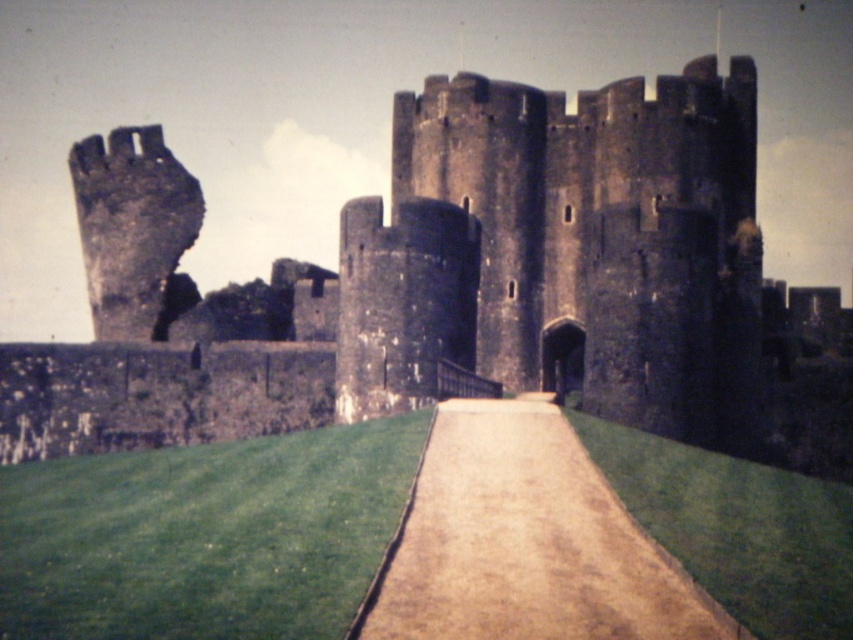
Between point (328, 328) and point (595, 580), which one is positioned in front?

Point (595, 580)

Which is in front, point (10, 432) or point (590, 458)?

Point (590, 458) is more forward.

Image resolution: width=853 pixels, height=640 pixels. In order to click on dark stone castle at center in this screenshot , I will do `click(465, 285)`.

Consider the image. Does dark stone castle at center appear over green grass at lower left?

Yes.

Is dark stone castle at center positioned in front of green grass at lower left?

No, dark stone castle at center is behind green grass at lower left.

Image resolution: width=853 pixels, height=640 pixels. What do you see at coordinates (465, 285) in the screenshot?
I see `dark stone castle at center` at bounding box center [465, 285].

Identify the location of dark stone castle at center. The width and height of the screenshot is (853, 640). (465, 285).

Is green grass at lower left shorter than brown gravel path at center?

Yes, green grass at lower left is shorter than brown gravel path at center.

Is point (264, 461) positioned before point (392, 563)?

No, it is behind (392, 563).

Who is more distant from viewer, (193,589) or (556,444)?

Positioned behind is point (556,444).

Where is `green grass at lower left`? green grass at lower left is located at coordinates (204, 536).